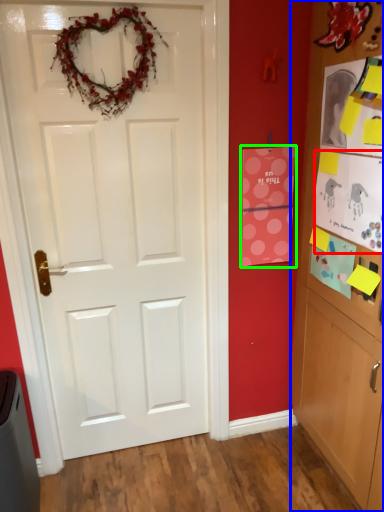
Question: Which object is the farthest from postcard (highlighted by a red box)? Choose among these: cabinetry (highlighted by a blue box) or postcard (highlighted by a green box).

Choices:
 (A) cabinetry
 (B) postcard

Answer: (B)